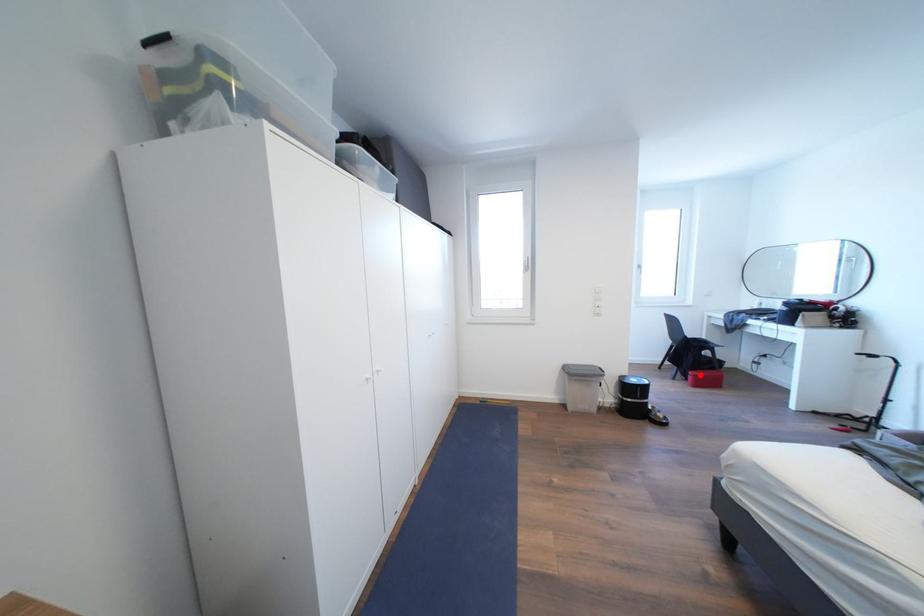
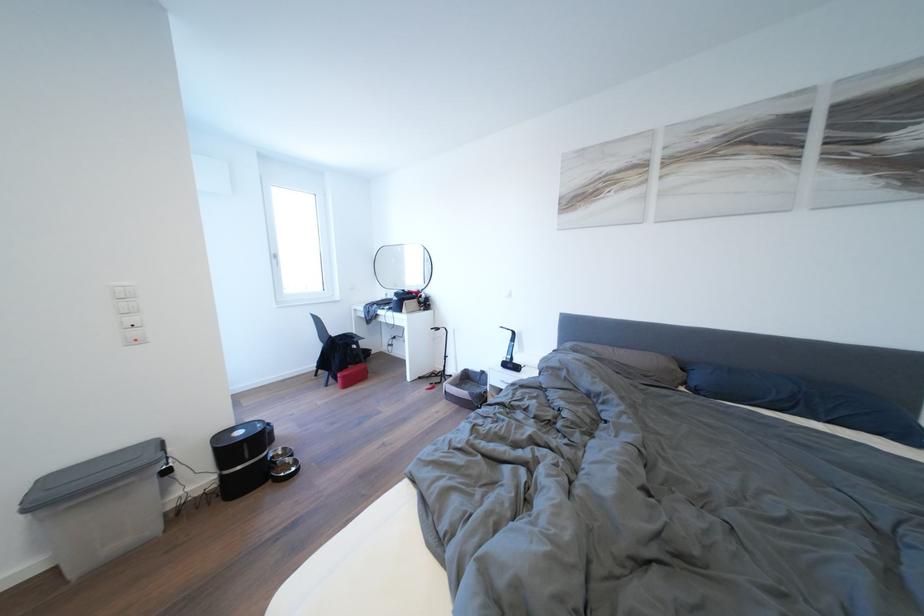
Question: I am providing you with two images of the same scene from different viewpoints. A red point is shown in image1. For the corresponding object point in image2, is it positioned nearer or farther from the camera?

Choices:
 (A) Nearer
 (B) Farther

Answer: (A)